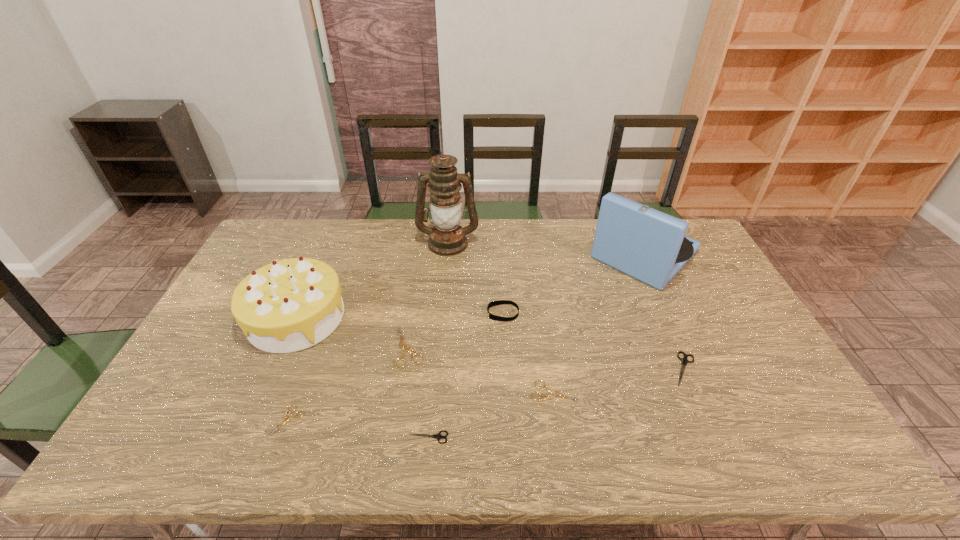
What are the coordinates of `free region located 0.370m on the display of the sixth shortest object` in the screenshot? It's located at coord(364,313).

Image resolution: width=960 pixels, height=540 pixels. In order to click on free spot located 0.210m on the display of the sixth shortest object in this screenshot , I will do `click(417, 313)`.

Locate an element on the screen. This screenshot has width=960, height=540. vacant space located on the front of the rightmost shears is located at coordinates click(x=700, y=404).

Image resolution: width=960 pixels, height=540 pixels. Find the location of `vacant space situated 0.270m on the back of the second beige shears from left to right`. vacant space situated 0.270m on the back of the second beige shears from left to right is located at coordinates (421, 268).

The width and height of the screenshot is (960, 540). I want to click on vacant space situated on the right of the second smallest beige shears, so click(x=728, y=392).

Identify the location of vacant region located 0.200m on the back of the smaller black shears. (435, 363).

This screenshot has height=540, width=960. I want to click on free space located on the right of the smallest beige shears, so click(422, 421).

This screenshot has width=960, height=540. Find the location of `lantern at the far edge`. lantern at the far edge is located at coordinates (447, 238).

Locate an element on the screen. phonograph record that is at the far edge is located at coordinates (646, 244).

What are the coordinates of `object situated at the left edge` in the screenshot? It's located at (289, 305).